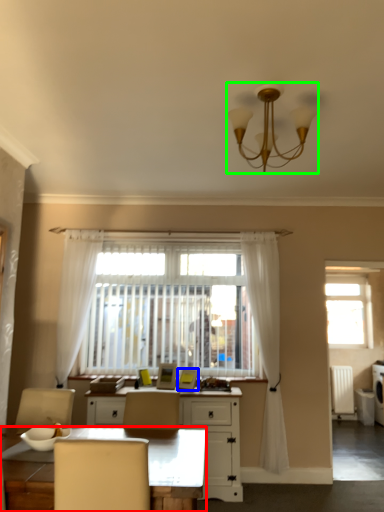
Question: Which object is the farthest from desk (highlighted by a red box)? Choose among these: picture frame (highlighted by a blue box) or lamp (highlighted by a green box).

Choices:
 (A) picture frame
 (B) lamp

Answer: (A)